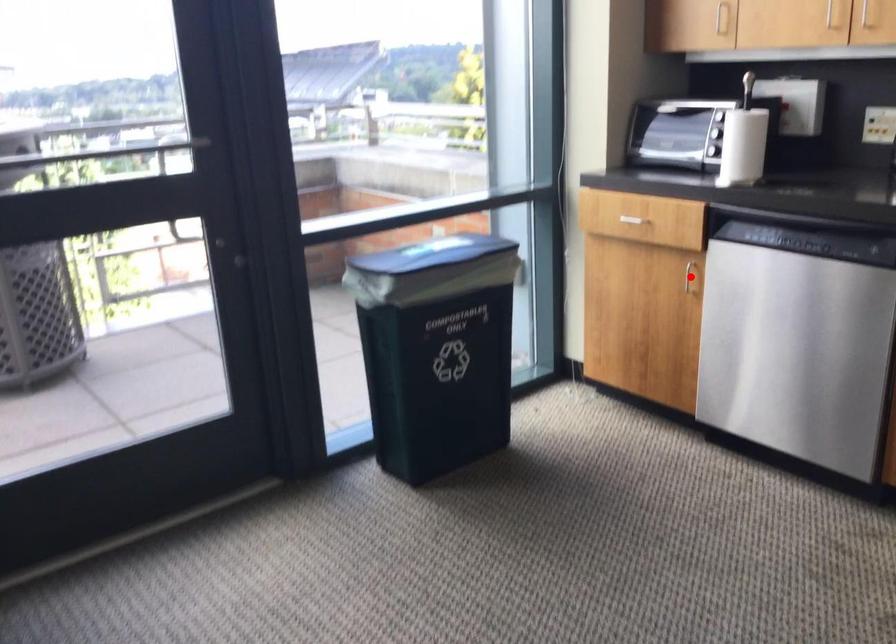
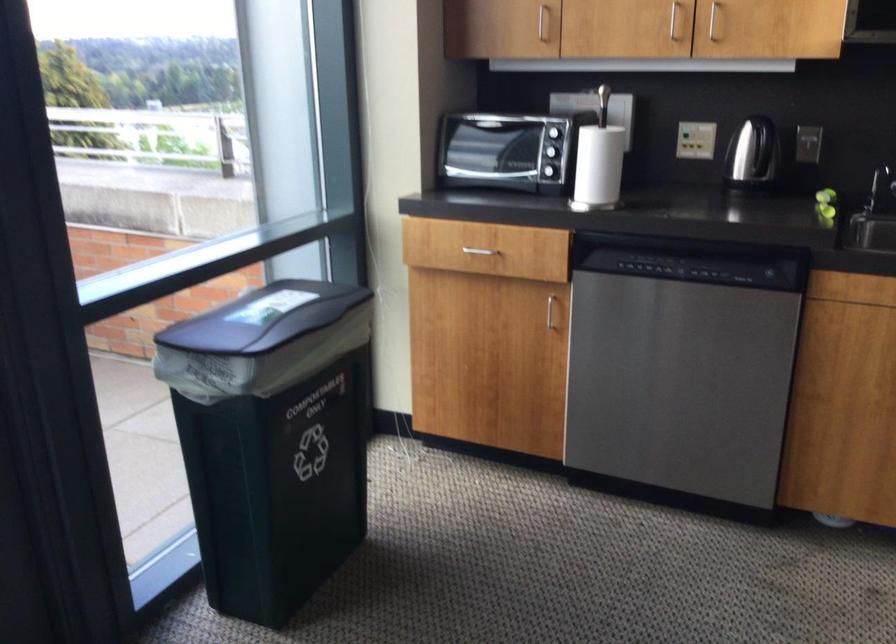
Question: I am providing you with two images of the same scene from different viewpoints. A red point is shown in image1. For the corresponding object point in image2, is it positioned nearer or farther from the camera?

Choices:
 (A) Nearer
 (B) Farther

Answer: (A)